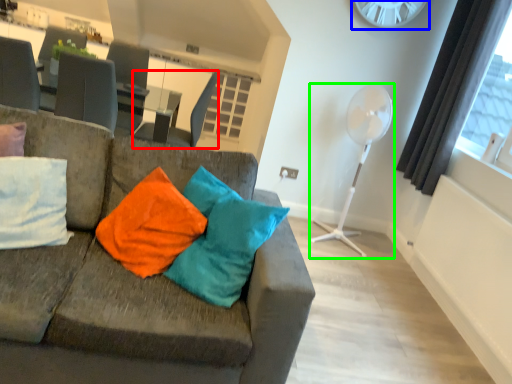
Question: Which object is the farthest from swivel chair (highlighted by a red box)? Choose among these: clock (highlighted by a blue box) or fan (highlighted by a green box).

Choices:
 (A) clock
 (B) fan

Answer: (A)